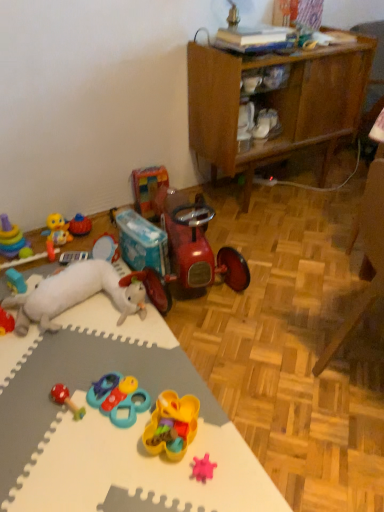
Identify the location of vacant space in between translucent yellow plastic toy at center, the second toy in the right-to-left sequence, and teal plastic toy at center, the 5th toy viewed from the right. Image resolution: width=384 pixels, height=512 pixels. (144, 404).